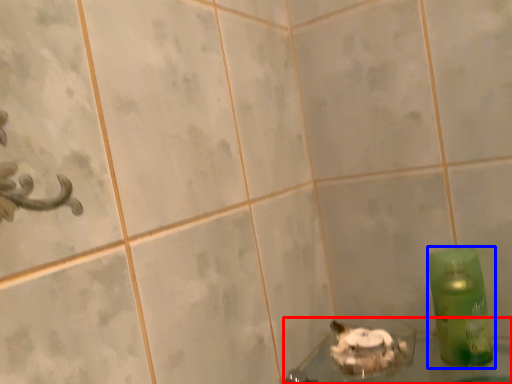
Question: Which point is further to the camera, bath (highlighted by a red box) or bottle (highlighted by a blue box)?

Choices:
 (A) bath
 (B) bottle

Answer: (B)